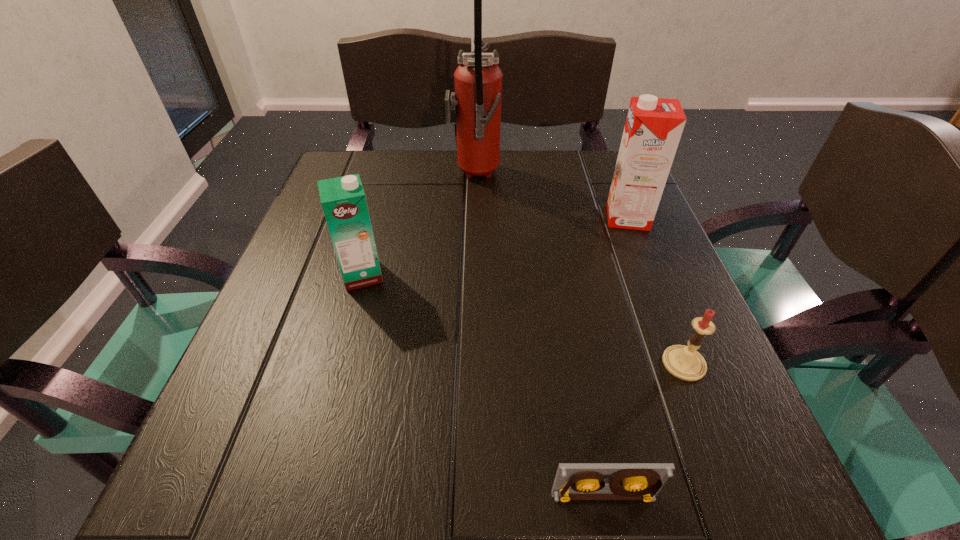
Where is `object that is at the near right corner`? The width and height of the screenshot is (960, 540). object that is at the near right corner is located at coordinates (574, 481).

Identify the location of free space at the far edge of the desktop. The height and width of the screenshot is (540, 960). coord(515,190).

Locate an element on the screen. The image size is (960, 540). vacant space at the near edge is located at coordinates (511, 483).

Locate an element on the screen. The image size is (960, 540). vacant space at the left edge of the desktop is located at coordinates (340, 288).

This screenshot has height=540, width=960. I want to click on free spot at the right edge of the desktop, so click(x=618, y=355).

This screenshot has width=960, height=540. Identify the location of vacant area at the far left corner. (335, 159).

Find the location of a particular element. The image size is (960, 540). vacant area between the shortest object and the candle is located at coordinates (643, 430).

The image size is (960, 540). Identify the location of vacant region between the nearest object and the candle. (643, 430).

Identify the location of vacant space that is in between the second nearest object and the second tallest object. (656, 291).

I want to click on free space between the candle and the taller carton, so click(656, 291).